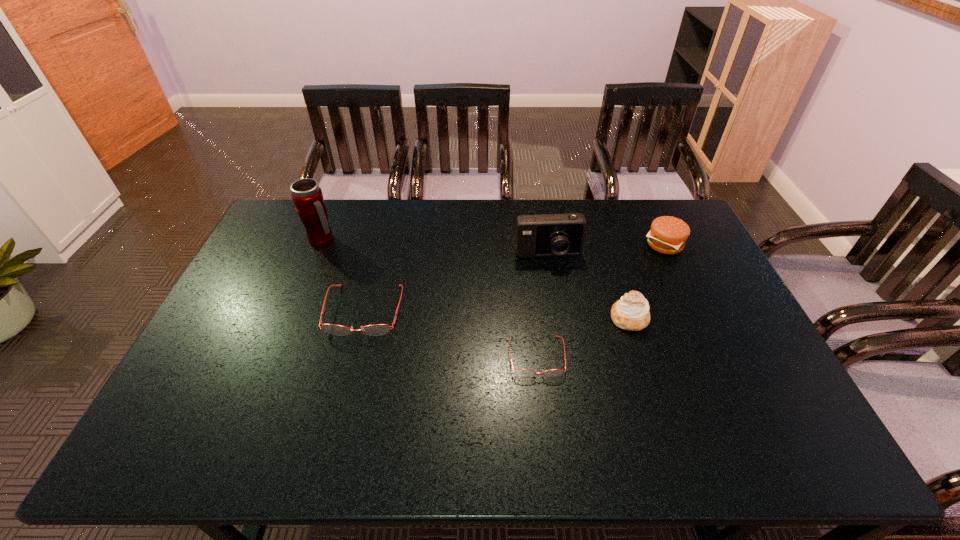
Find the location of a particular element. This screenshot has width=960, height=540. the left spectacles is located at coordinates (377, 329).

Find the location of a particular element. the taller spectacles is located at coordinates (377, 329).

This screenshot has height=540, width=960. Find the location of `the shorter spectacles`. the shorter spectacles is located at coordinates (523, 372).

The height and width of the screenshot is (540, 960). Find the location of `the shortest object`. the shortest object is located at coordinates click(523, 372).

Image resolution: width=960 pixels, height=540 pixels. What are the coordinates of `camera` in the screenshot? It's located at (549, 235).

At what (x,y) coordinates should I click in order to perform the action: click on the leftmost object. Please return your answer as a coordinate pair (x, y). This screenshot has height=540, width=960. Looking at the image, I should click on (307, 196).

This screenshot has height=540, width=960. I want to click on thermos bottle, so click(307, 196).

Where is `the rightmost object`? This screenshot has width=960, height=540. the rightmost object is located at coordinates click(x=668, y=235).

Locate an element on the screen. Image resolution: width=960 pixels, height=540 pixels. pastry is located at coordinates (631, 312).

The height and width of the screenshot is (540, 960). I want to click on vacant space positioned 0.140m on the lenses of the taller spectacles, so click(347, 382).